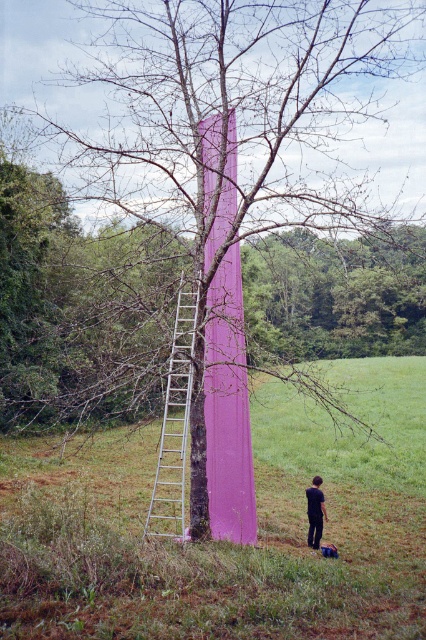
Question: Is pink matte tower at center to the left of black matte pants at lower right from the viewer's perspective?

Choices:
 (A) no
 (B) yes

Answer: (B)

Question: Where is silver metallic ladder at center located in relation to black matte pants at lower right in the image?

Choices:
 (A) below
 (B) above

Answer: (A)

Question: Which is nearer to the black matte pants at lower right?

Choices:
 (A) pink matte tower at center
 (B) silver metallic ladder at center

Answer: (B)

Question: Does pink matte tower at center appear on the right side of black matte pants at lower right?

Choices:
 (A) yes
 (B) no

Answer: (B)

Question: Which point appears farthest from the camera in this image?

Choices:
 (A) (261, 380)
 (B) (313, 520)

Answer: (A)

Question: Which object is positioned farthest from the pink matte tower at center?

Choices:
 (A) black matte pants at lower right
 (B) silver metallic ladder at center

Answer: (B)